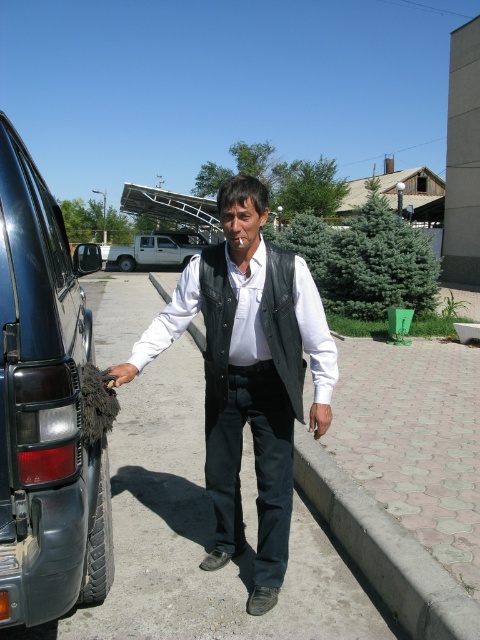
You are a delivery driver who needs to park your vehicle in this area. You have a delivery truck that is 10 feet wide. The dark gray rubber tire at left and the white matte pickup truck at center are already parked here. Can you fit your truck between them without overlapping?

The dark gray rubber tire at left occupies less space than the white matte pickup truck at center. Since the tire is smaller, there might be enough space between them to fit your 10 feet wide delivery truck, but you need to ensure the total available space between them is at least 10 feet. However, without exact measurements, it is uncertain. Please check the actual distance.

You are standing at the center of the image. Which object is closer to the left edge of the image, the dark gray rubber tire at left or the green pine tree to the right?

The dark gray rubber tire at left is closer to the left edge of the image because its 2D location at point (46,406) places it more to the left compared to the green pine tree to the right.